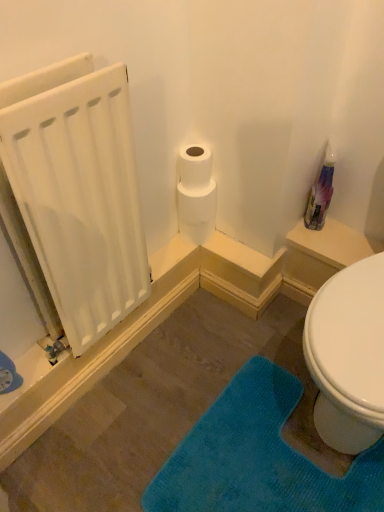
In order to click on free space above teal plush bath mat at lower right (from a real-world perspective) in this screenshot , I will do `click(266, 452)`.